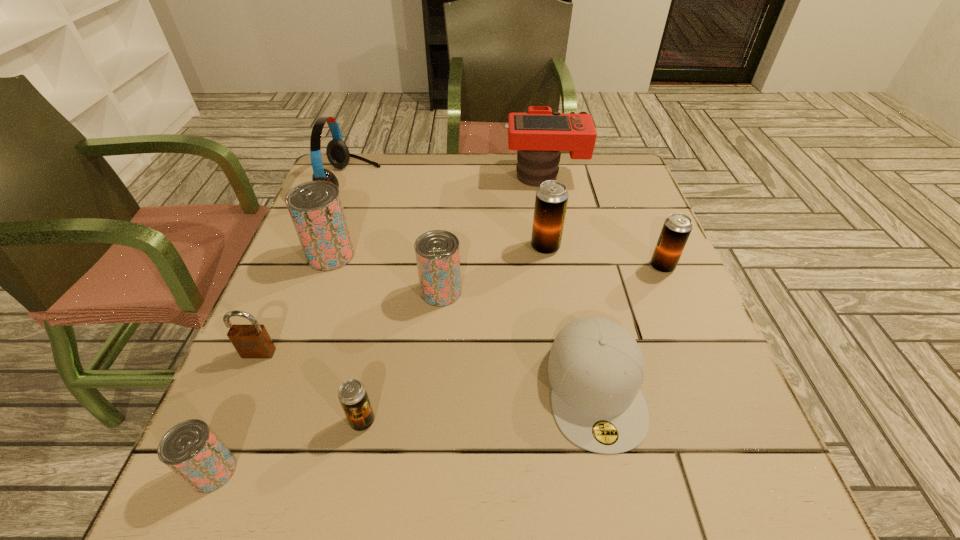
I want to click on padlock that is at the left edge, so click(250, 341).

This screenshot has height=540, width=960. Find the location of `camera present at the right edge`. camera present at the right edge is located at coordinates (539, 134).

This screenshot has height=540, width=960. I want to click on beer can present at the right edge, so 676,229.

This screenshot has height=540, width=960. Find the location of `cap located in the right edge section of the desktop`. cap located in the right edge section of the desktop is located at coordinates (595, 368).

Locate an element on the screen. The image size is (960, 540). object at the far left corner is located at coordinates (337, 152).

Where is `object positioned at the near left corner`? This screenshot has width=960, height=540. object positioned at the near left corner is located at coordinates (190, 449).

Locate an element on the screen. object that is at the far right corner is located at coordinates (539, 134).

At what (x,y) coordinates should I click in order to perform the action: click on object at the near right corner. Please return your answer as a coordinate pair (x, y). Looking at the image, I should click on (595, 368).

Identify the location of free point at the far edge. The width and height of the screenshot is (960, 540). (440, 163).

In the image, there is a desktop. Identify the location of vacant area at the near edge. (569, 510).